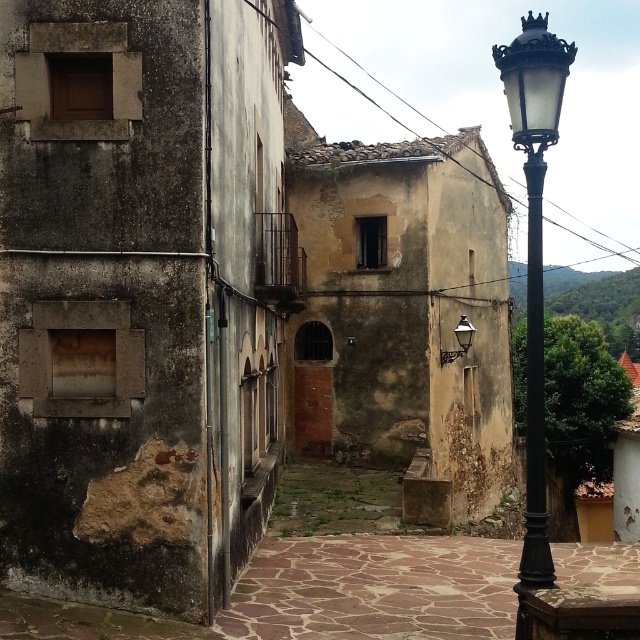
You are a delivery person in a historic European town. You need to determine if your 1.2 meter wide package can fit between the black metal street light at upper right and the matte black lamp at upper right. Can it fit?

The black metal street light at upper right is wider than the matte black lamp at upper right. However, since the exact width difference isn not specified, it is impossible to determine if the 1.2 meter wide package can fit between them.

You are a tourist standing in the middle of the alleyway and want to take a photo of both the black metal street light at upper right and the matte black lamp at upper right. Which one is closer to you?

The black metal street light at upper right is closer to the viewer than the matte black lamp at upper right, so it is closer to you.